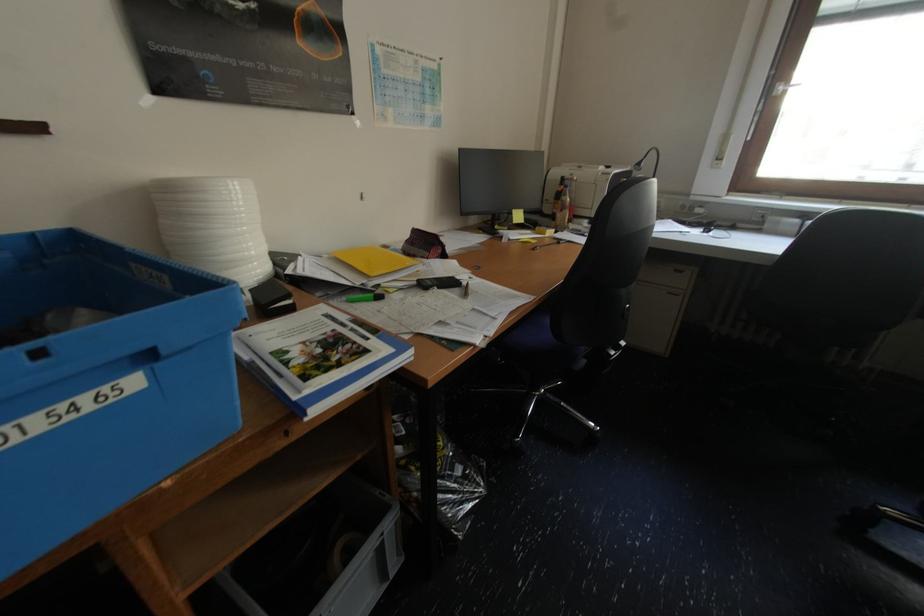
The location [213,225] corresponds to which object?

It refers to a white plastic lid.